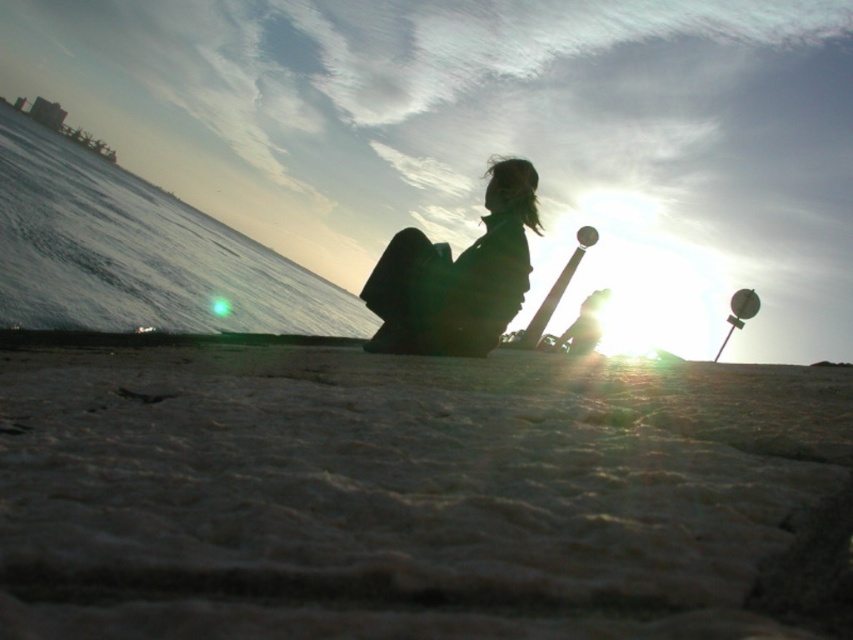
Question: Where is sandy textured ground at lower center located in relation to silhouette fabric at center in the image?

Choices:
 (A) left
 (B) right

Answer: (B)

Question: Which object is closer to the camera taking this photo?

Choices:
 (A) silhouette fabric at center
 (B) gray water at lower left
 (C) sandy textured ground at lower center

Answer: (C)

Question: Is sandy textured ground at lower center above silhouette fabric at center?

Choices:
 (A) yes
 (B) no

Answer: (B)

Question: Which is farther from the sandy textured ground at lower center?

Choices:
 (A) silhouette fabric at center
 (B) gray water at lower left

Answer: (B)

Question: Which of the following is the farthest from the observer?

Choices:
 (A) sandy textured ground at lower center
 (B) gray water at lower left
 (C) silhouette fabric at center

Answer: (B)

Question: Does sandy textured ground at lower center have a greater width compared to gray water at lower left?

Choices:
 (A) yes
 (B) no

Answer: (B)